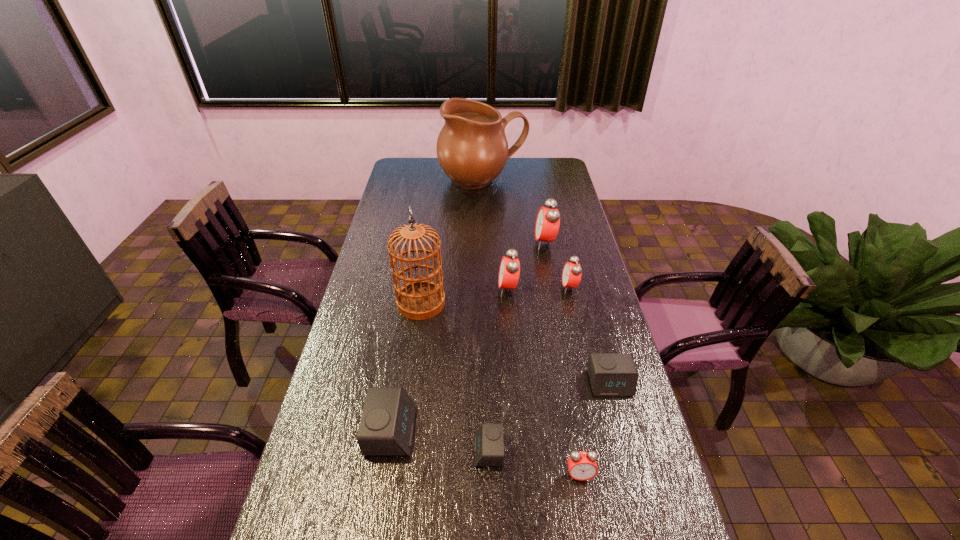
This screenshot has height=540, width=960. I want to click on red alarm clock that stands as the third closest to the farthest black alarm clock, so click(509, 271).

Point out which red alarm clock is positioned as the nearest to the rightmost black alarm clock. Please provide its 2D coordinates. Your answer should be formatted as a tuple, i.e. [(x, y)], where the tuple contains the x and y coordinates of a point satisfying the conditions above.

[(582, 466)]

This screenshot has height=540, width=960. I want to click on black alarm clock identified as the third closest to the nearest red alarm clock, so click(x=386, y=428).

Locate an element on the screen. the third closest black alarm clock relative to the farthest red alarm clock is located at coordinates (386, 428).

The width and height of the screenshot is (960, 540). I want to click on vacant area that satisfies the following two spatial constraints: 1. on the front-facing side of the rightmost black alarm clock; 2. on the front-facing side of the shortest alarm clock, so click(x=628, y=450).

Image resolution: width=960 pixels, height=540 pixels. What are the coordinates of `free spot that satisfies the following two spatial constraints: 1. at the spout of the farthest object; 2. on the front-facing side of the biggest black alarm clock` in the screenshot? It's located at (485, 431).